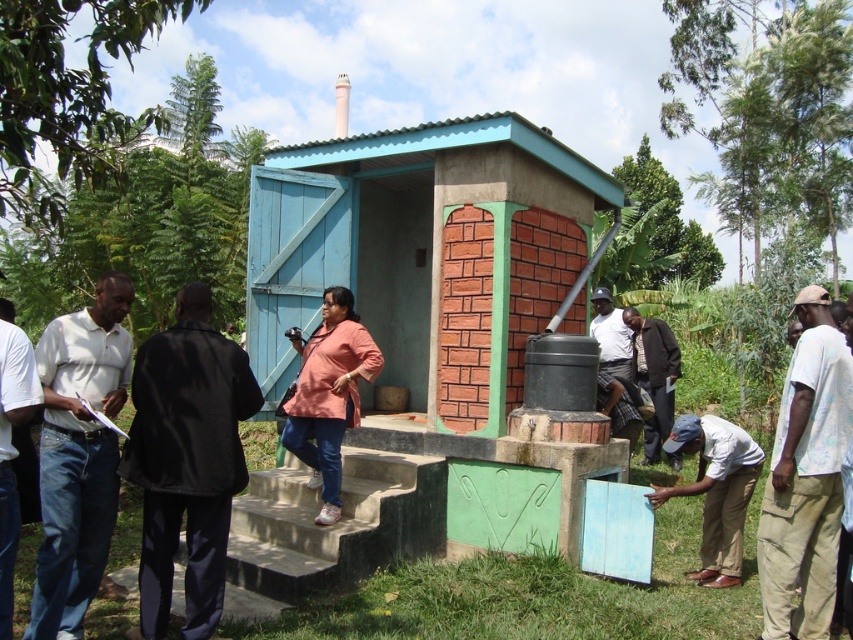
Can you confirm if white shirt at left is taller than dark brown plaid shirt at center?

Indeed, white shirt at left has a greater height compared to dark brown plaid shirt at center.

Between white shirt at left and dark brown plaid shirt at center, which one has less height?

dark brown plaid shirt at center is shorter.

At what (x,y) coordinates should I click in order to perform the action: click on white shirt at left. Please return your answer as a coordinate pair (x, y). This screenshot has width=853, height=640. Looking at the image, I should click on (78, 454).

Locate an element on the screen. This screenshot has height=640, width=853. white shirt at left is located at coordinates (78, 454).

Between blue painted wood at center and white shirt at center, which one is positioned higher?

blue painted wood at center is higher up.

Between point (393, 364) and point (619, 380), which one is positioned in front?

Positioned in front is point (619, 380).

What are the coordinates of `blue painted wood at center` in the screenshot? It's located at (445, 307).

Is white shirt at left to the left of white shirt at center from the viewer's perspective?

Correct, you'll find white shirt at left to the left of white shirt at center.

At what (x,y) coordinates should I click in order to perform the action: click on white shirt at left. Please return your answer as a coordinate pair (x, y). This screenshot has width=853, height=640. Looking at the image, I should click on (78, 454).